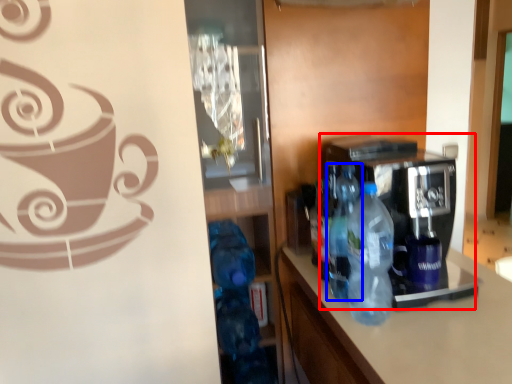
Question: Which object appears closest to the camera in this image, coffee machine (highlighted by a red box) or bottle (highlighted by a blue box)?

Choices:
 (A) coffee machine
 (B) bottle

Answer: (A)